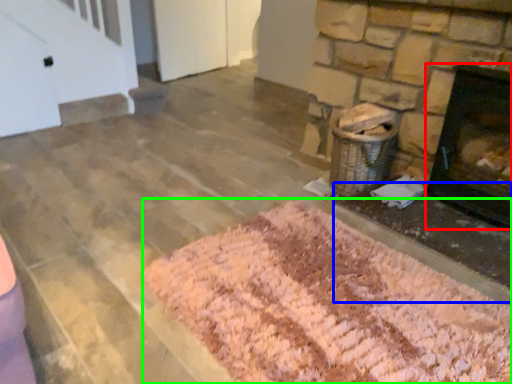
Question: Considering the real-world distances, which object is farthest from fireplace (highlighted by a red box)? foundation (highlighted by a blue box) or mat (highlighted by a green box)?

Choices:
 (A) foundation
 (B) mat

Answer: (B)